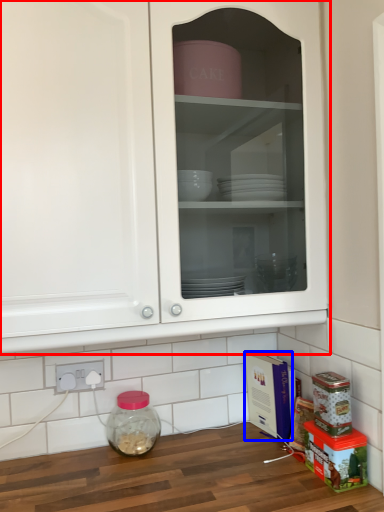
Question: Among these objects, which one is farthest to the camera, cabinetry (highlighted by a red box) or cardboard box (highlighted by a blue box)?

Choices:
 (A) cabinetry
 (B) cardboard box

Answer: (B)